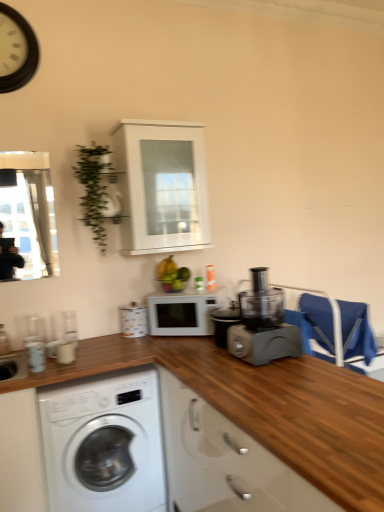
At what (x,y) coordinates should I click in order to perform the action: click on free point in front of white glossy canister at upper center, which ranks as the 1th appliance in back-to-front order. Please return your answer as a coordinate pair (x, y). Looking at the image, I should click on (124, 345).